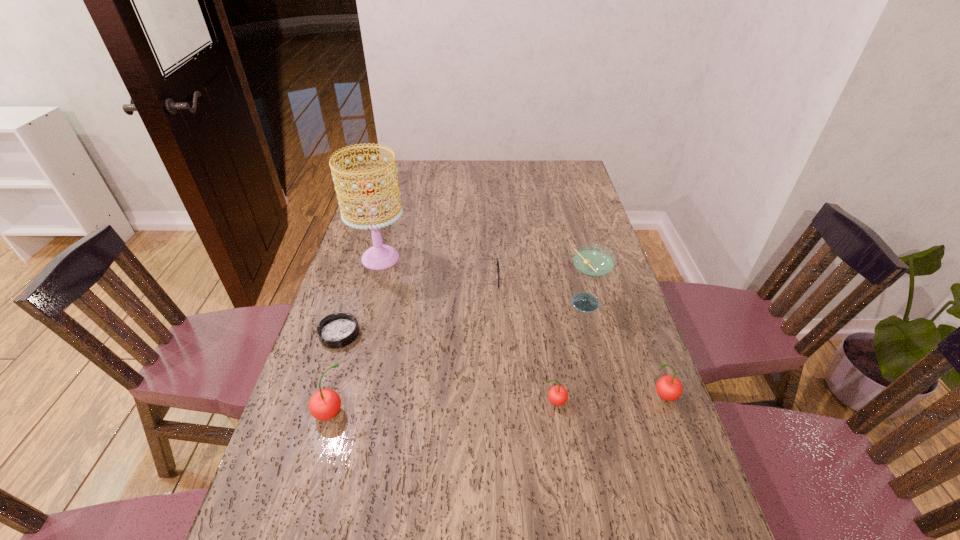
Locate an element on the screen. Image resolution: width=960 pixels, height=540 pixels. cherry that is at the left edge is located at coordinates (324, 404).

Locate an element on the screen. lampshade that is positioned at the left edge is located at coordinates (380, 256).

Locate an element on the screen. The height and width of the screenshot is (540, 960). ashtray that is at the left edge is located at coordinates (337, 330).

This screenshot has width=960, height=540. Find the location of `cherry situated at the right edge`. cherry situated at the right edge is located at coordinates (669, 388).

Where is `martini that is positioned at the right edge`? The width and height of the screenshot is (960, 540). martini that is positioned at the right edge is located at coordinates (592, 260).

At what (x,y) coordinates should I click in order to perform the action: click on vacant space at the far edge. Please return your answer as a coordinate pair (x, y). The image size is (960, 540). Looking at the image, I should click on (479, 181).

Identify the location of free point at the left edge. This screenshot has width=960, height=540. (302, 476).

The height and width of the screenshot is (540, 960). I want to click on vacant area at the right edge, so click(584, 318).

I want to click on vacant space at the far right corner of the desktop, so click(570, 172).

You are a GUI agent. You are given a task and a screenshot of the screen. Output one action in this format:
    pyautogui.click(x=<x>, y=<y>)
    Task: Click on the free space between the martini and the leftmost cherry
    The width and height of the screenshot is (960, 540).
    Given the screenshot: What is the action you would take?
    pyautogui.click(x=458, y=359)